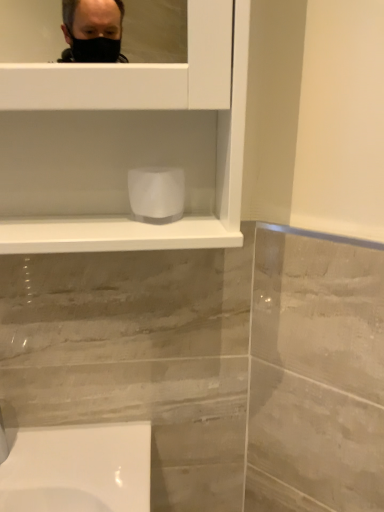
Question: From the image's perspective, is white matte toilet paper at center above matte silver faucet at lower left?

Choices:
 (A) no
 (B) yes

Answer: (B)

Question: Would you consider white matte toilet paper at center to be distant from matte silver faucet at lower left?

Choices:
 (A) yes
 (B) no

Answer: (B)

Question: Is white matte toilet paper at center wider than matte silver faucet at lower left?

Choices:
 (A) yes
 (B) no

Answer: (B)

Question: Considering the relative positions of white matte toilet paper at center and matte silver faucet at lower left in the image provided, is white matte toilet paper at center to the right of matte silver faucet at lower left from the viewer's perspective?

Choices:
 (A) yes
 (B) no

Answer: (A)

Question: From the image's perspective, is white matte toilet paper at center beneath matte silver faucet at lower left?

Choices:
 (A) no
 (B) yes

Answer: (A)

Question: Does white matte toilet paper at center have a lesser height compared to matte silver faucet at lower left?

Choices:
 (A) no
 (B) yes

Answer: (B)

Question: Considering the relative positions of matte silver faucet at lower left and white matte toilet paper at center in the image provided, is matte silver faucet at lower left to the left of white matte toilet paper at center from the viewer's perspective?

Choices:
 (A) no
 (B) yes

Answer: (B)

Question: Is matte silver faucet at lower left facing towards white matte toilet paper at center?

Choices:
 (A) no
 (B) yes

Answer: (A)

Question: Considering the relative sizes of matte silver faucet at lower left and white matte toilet paper at center in the image provided, is matte silver faucet at lower left taller than white matte toilet paper at center?

Choices:
 (A) no
 (B) yes

Answer: (B)

Question: From a real-world perspective, is matte silver faucet at lower left below white matte toilet paper at center?

Choices:
 (A) yes
 (B) no

Answer: (A)

Question: Is white matte toilet paper at center a part of matte silver faucet at lower left?

Choices:
 (A) no
 (B) yes

Answer: (A)

Question: Are matte silver faucet at lower left and white matte toilet paper at center located far from each other?

Choices:
 (A) yes
 (B) no

Answer: (B)

Question: Looking at their shapes, would you say white matte toilet paper at center is wider or thinner than matte silver faucet at lower left?

Choices:
 (A) wide
 (B) thin

Answer: (B)